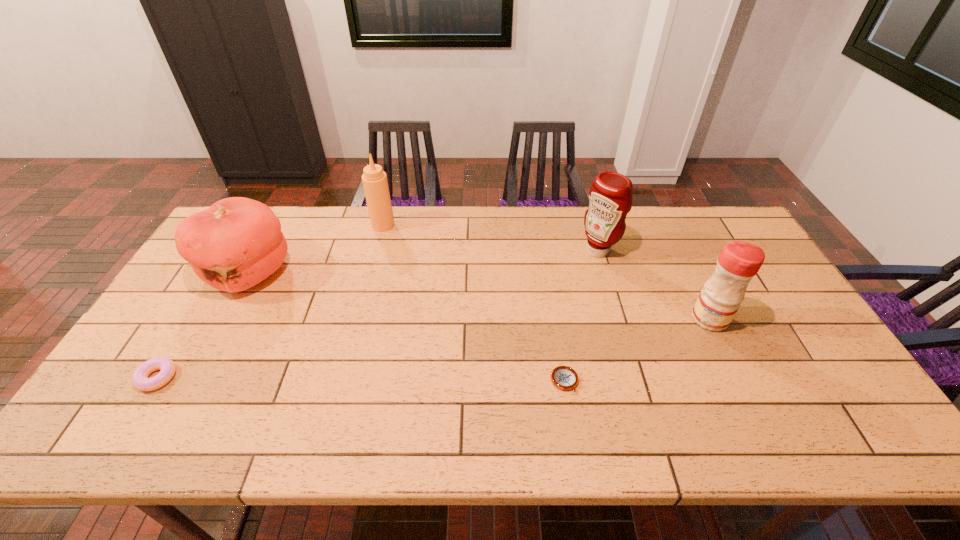
You are a GUI agent. You are given a task and a screenshot of the screen. Output one action in this format:
    pyautogui.click(x=<x>, y=<y>)
    Task: Click on the free space at the far edge of the desktop
    This screenshot has height=540, width=960.
    Given the screenshot: What is the action you would take?
    pyautogui.click(x=410, y=222)

Identify the location of vacant area at the left edge of the desktop. (128, 402).

In the image, there is a desktop. Identify the location of vacant space at the right edge. (745, 318).

At what (x,y) coordinates should I click in order to perform the action: click on free location at the far right corner. Please return your answer as a coordinate pair (x, y). Image resolution: width=960 pixels, height=540 pixels. Looking at the image, I should click on (702, 243).

The width and height of the screenshot is (960, 540). Find the location of `empty space that is in between the doughnut and the pumpkin`. empty space that is in between the doughnut and the pumpkin is located at coordinates (204, 325).

This screenshot has width=960, height=540. I want to click on empty location between the third nearest object and the third object from left to right, so click(x=546, y=272).

I want to click on vacant space in between the farthest object and the compass, so click(x=473, y=303).

Locate an element on the screen. free space between the second condiment from right to left and the pumpkin is located at coordinates (423, 261).

Where is `free space that is in between the rightmost condiment and the second condiment from right to left`? The image size is (960, 540). free space that is in between the rightmost condiment and the second condiment from right to left is located at coordinates (654, 285).

Locate an element on the screen. vacant region between the fourth object from right to left and the second condiment from left to right is located at coordinates (491, 238).